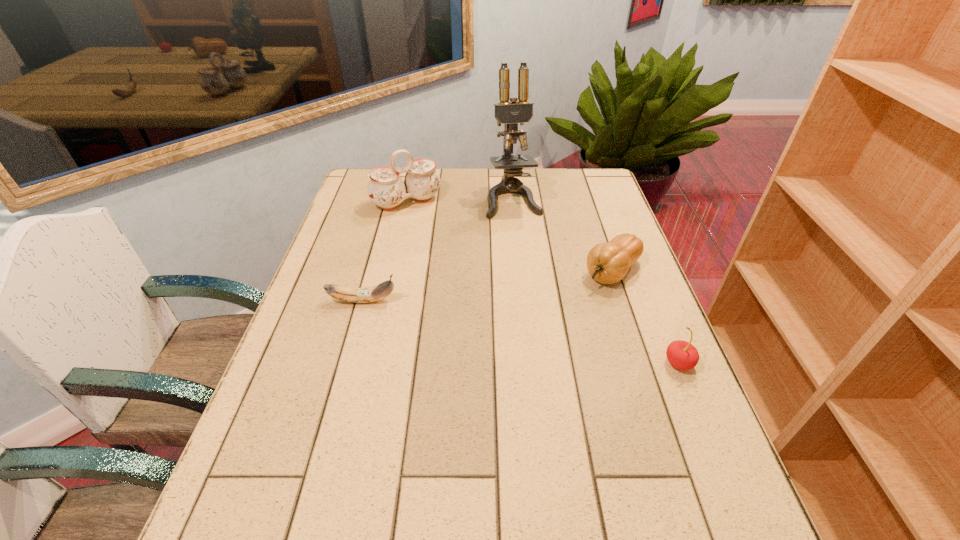
Locate an element on the screen. chinaware that is at the left edge is located at coordinates (386, 189).

You are a GUI agent. You are given a task and a screenshot of the screen. Output one action in this format:
    pyautogui.click(x=<x>, y=<y>)
    Task: Click on the cherry present at the right edge
    
    Given the screenshot: What is the action you would take?
    pyautogui.click(x=682, y=355)

Where is `gourd that is at the right edge`? The height and width of the screenshot is (540, 960). gourd that is at the right edge is located at coordinates (607, 263).

Identify the location of object at the far left corner. (386, 189).

The image size is (960, 540). In order to click on blank space at the far edge of the desktop in this screenshot , I will do `click(460, 187)`.

In the image, there is a desktop. Identify the location of blank space at the near edge. (562, 450).

You are a GUI agent. You are given a task and a screenshot of the screen. Output one action in this format:
    pyautogui.click(x=<x>, y=<y>)
    Task: Click on the vacant space at the left edge of the desktop
    
    Given the screenshot: What is the action you would take?
    [382, 208]

This screenshot has width=960, height=540. Find the location of `vacant space at the right edge of the desktop`. vacant space at the right edge of the desktop is located at coordinates (654, 352).

You are a GUI agent. You are given a task and a screenshot of the screen. Output one action in this format:
    pyautogui.click(x=<x>, y=<y>)
    Task: Click on the vacant space at the far left corner
    The height and width of the screenshot is (540, 960).
    Given the screenshot: What is the action you would take?
    367,194

At what (x,y) coordinates should I click in order to perform the action: click on blank space at the far right corner. Please return your answer as a coordinate pair (x, y). The height and width of the screenshot is (540, 960). Looking at the image, I should click on (569, 201).